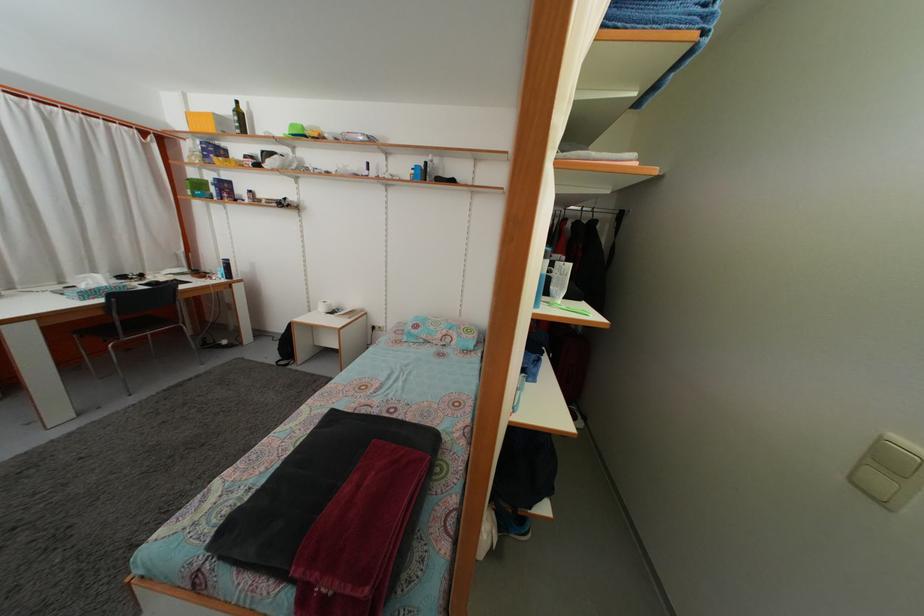
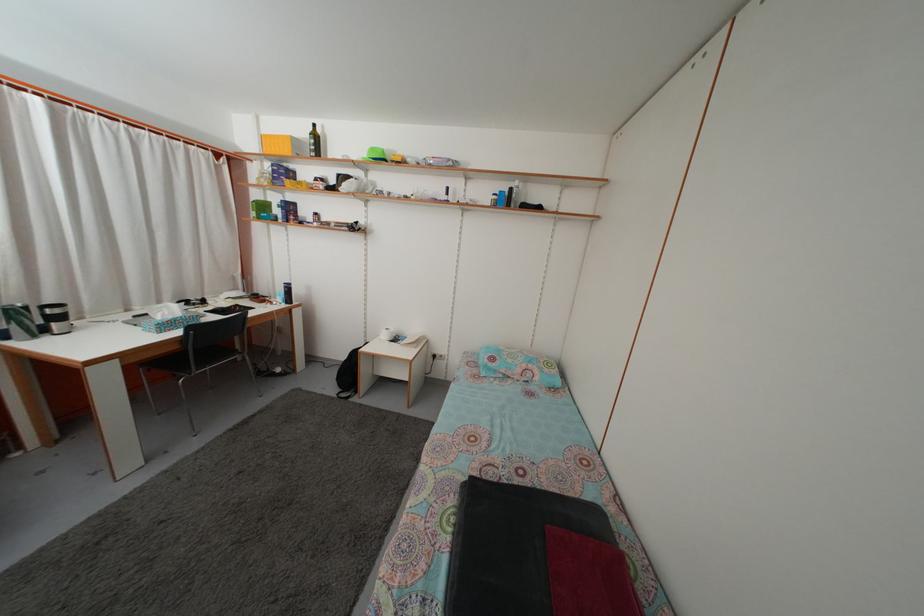
Question: What movement of the cameraman would produce the second image?

Choices:
 (A) Left
 (B) Right
 (C) Forward
 (D) Backward

Answer: (A)